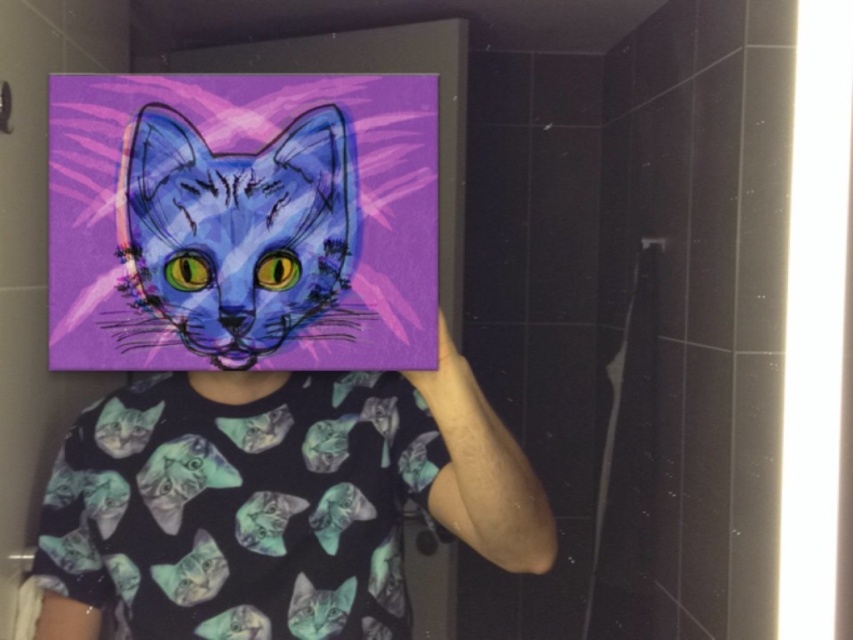
Which is more to the right, matte purple painting at upper center or matte blue cat at upper left?

Positioned to the right is matte blue cat at upper left.

Is matte purple painting at upper center behind matte blue cat at upper left?

Yes.

Between point (126, 468) and point (190, 202), which one is positioned in front?

Point (190, 202)

This screenshot has width=853, height=640. In order to click on matte purple painting at upper center in this screenshot , I will do `click(270, 484)`.